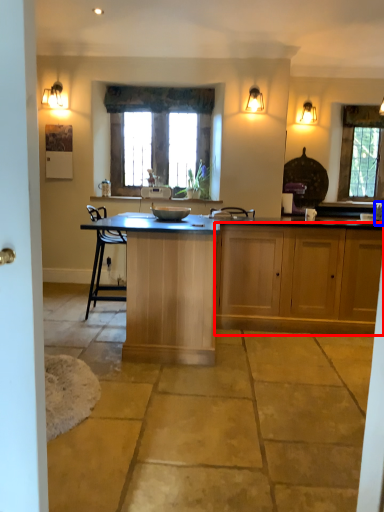
Question: Which object appears farthest to the camera in this image, cabinetry (highlighted by a red box) or faucet (highlighted by a blue box)?

Choices:
 (A) cabinetry
 (B) faucet

Answer: (B)